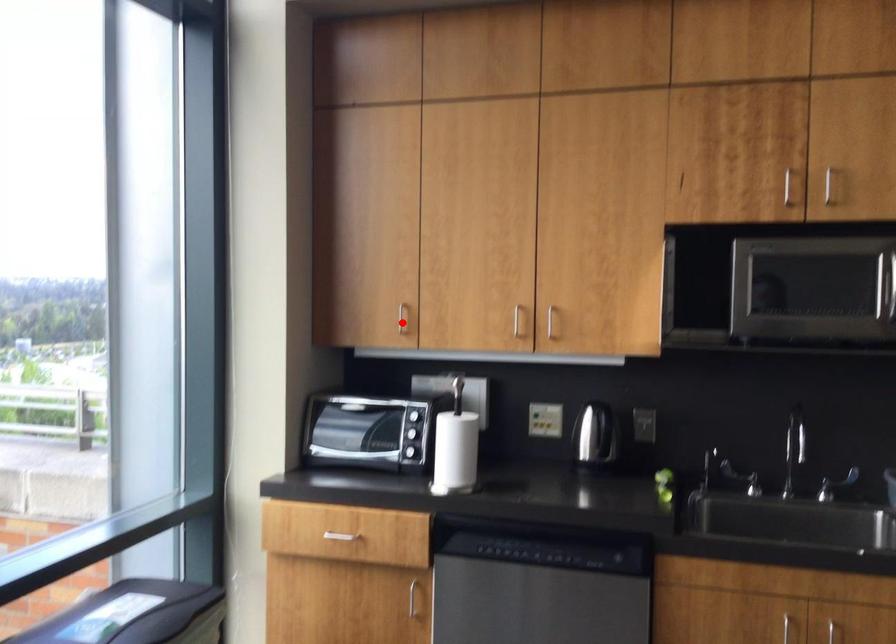
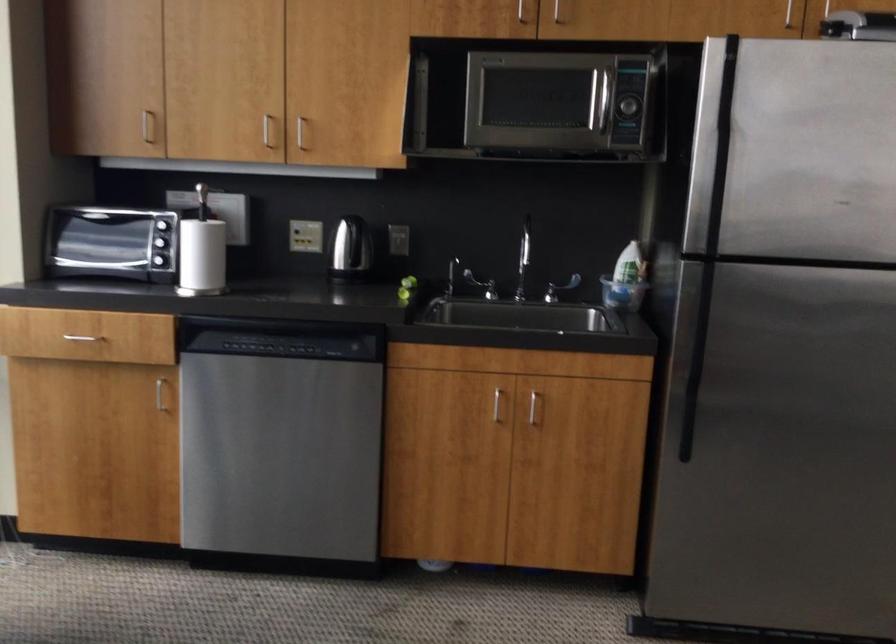
The point at the highlighted location is marked in the first image. Where is the corresponding point in the second image?

(147, 126)